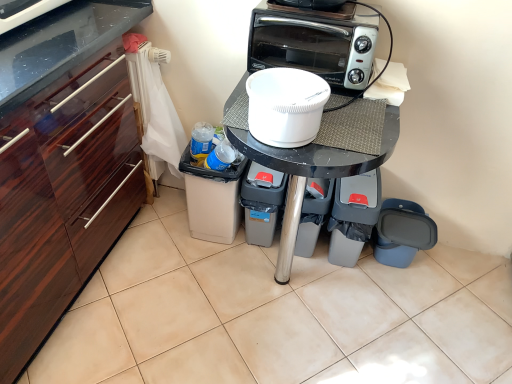
The width and height of the screenshot is (512, 384). Describe the element at coordinates (262, 202) in the screenshot. I see `gray plastic trash bin at lower center, positioned as the first appliance in left-to-right order` at that location.

At what (x,y) coordinates should I click in order to perform the action: click on white plastic container at center. Please return your answer as a coordinate pair (x, y). Looking at the image, I should click on (285, 106).

Measure the distance between gray plastic trash can at lower center, positioned as the 2th appliance in left-to-right order, and camera.

1.49 meters.

I want to click on gray plastic trash can at lower right, placed as the second appliance when sorted from right to left, so click(x=353, y=216).

Could gray plastic trash can at lower center, positioned as the 2th appliance in left-to-right order, be considered to be inside white plastic container at center?

No, gray plastic trash can at lower center, positioned as the 2th appliance in left-to-right order, is not a part of white plastic container at center.

Considering the sizes of objects white plastic container at center and gray plastic trash can at lower center, positioned as the 2th appliance in left-to-right order, in the image provided, who is shorter, white plastic container at center or gray plastic trash can at lower center, positioned as the 2th appliance in left-to-right order,?

white plastic container at center is shorter.

What's the angular difference between white plastic container at center and gray plastic trash can at lower center, positioned as the 2th appliance in left-to-right order,'s facing directions?

There is a 0.289-degree angle between the facing directions of white plastic container at center and gray plastic trash can at lower center, positioned as the 2th appliance in left-to-right order.

Would you consider white plastic container at center to be distant from gray plastic trash can at lower center, which is the 3th appliance in right-to-left order?

No, white plastic container at center is not far away from gray plastic trash can at lower center, which is the 3th appliance in right-to-left order.

Between gray plastic trash can at lower center, positioned as the 2th appliance in left-to-right order, and silver metallic toaster oven at upper center, which one has less height?

Standing shorter between the two is silver metallic toaster oven at upper center.

Where is `kitchen appliance in front of the gray plastic trash can at lower center, positioned as the 2th appliance in left-to-right order`? kitchen appliance in front of the gray plastic trash can at lower center, positioned as the 2th appliance in left-to-right order is located at coordinates (314, 42).

Is silver metallic toaster oven at upper center at the back of gray plastic trash can at lower center, which is the 3th appliance in right-to-left order?

No.

Which is more to the left, gray plastic trash can at lower center, positioned as the 2th appliance in left-to-right order, or silver metallic toaster oven at upper center?

From the viewer's perspective, silver metallic toaster oven at upper center appears more on the left side.

In the scene shown: From the image's perspective, is black glossy table at center over blue plastic trash can at lower right, which appears as the fourth appliance when viewed from the left?

Correct, black glossy table at center appears higher than blue plastic trash can at lower right, which appears as the fourth appliance when viewed from the left, in the image.

Does black glossy table at center appear on the left side of blue plastic trash can at lower right, acting as the 1th appliance starting from the right?

Yes.

Is black glossy table at center turned away from blue plastic trash can at lower right, acting as the 1th appliance starting from the right?

black glossy table at center does not have its back to blue plastic trash can at lower right, acting as the 1th appliance starting from the right.

How many degrees apart are the facing directions of gray plastic trash can at lower right, which ranks as the 3th appliance in left-to-right order, and gray plastic trash can at lower center, which is the 3th appliance in right-to-left order?

The facing directions of gray plastic trash can at lower right, which ranks as the 3th appliance in left-to-right order, and gray plastic trash can at lower center, which is the 3th appliance in right-to-left order, are 1.99e-05 degrees apart.

In terms of height, does gray plastic trash can at lower right, which ranks as the 3th appliance in left-to-right order, look taller or shorter compared to gray plastic trash can at lower center, positioned as the 2th appliance in left-to-right order?

In the image, gray plastic trash can at lower right, which ranks as the 3th appliance in left-to-right order, appears to be taller than gray plastic trash can at lower center, positioned as the 2th appliance in left-to-right order.

Which is in front, gray plastic trash can at lower right, which ranks as the 3th appliance in left-to-right order, or gray plastic trash can at lower center, positioned as the 2th appliance in left-to-right order?

gray plastic trash can at lower right, which ranks as the 3th appliance in left-to-right order, is closer to the camera.

Can you confirm if gray plastic trash can at lower right, which ranks as the 3th appliance in left-to-right order, is positioned to the right of gray plastic trash can at lower center, which is the 3th appliance in right-to-left order?

Correct, you'll find gray plastic trash can at lower right, which ranks as the 3th appliance in left-to-right order, to the right of gray plastic trash can at lower center, which is the 3th appliance in right-to-left order.

Between gray plastic trash can at lower center, positioned as the 2th appliance in left-to-right order, and white plastic container at center, which one has larger width?

With larger width is gray plastic trash can at lower center, positioned as the 2th appliance in left-to-right order.

From the picture: Is white plastic container at center located within gray plastic trash can at lower center, positioned as the 2th appliance in left-to-right order?

No.

From a real-world perspective, which is physically below, gray plastic trash can at lower center, positioned as the 2th appliance in left-to-right order, or white plastic container at center?

From a 3D spatial view, gray plastic trash can at lower center, positioned as the 2th appliance in left-to-right order, is below.

How different are the orientations of gray plastic trash can at lower center, positioned as the 2th appliance in left-to-right order, and white plastic container at center in degrees?

The angle between the facing direction of gray plastic trash can at lower center, positioned as the 2th appliance in left-to-right order, and the facing direction of white plastic container at center is 0.289 degrees.

Which is correct: gray plastic trash can at lower center, positioned as the 2th appliance in left-to-right order, is inside blue plastic trash can at lower right, acting as the 1th appliance starting from the right, or outside of it?

The correct answer is: outside.

Visually, is gray plastic trash can at lower center, positioned as the 2th appliance in left-to-right order, positioned to the left or to the right of blue plastic trash can at lower right, which appears as the fourth appliance when viewed from the left?

gray plastic trash can at lower center, positioned as the 2th appliance in left-to-right order, is to the left of blue plastic trash can at lower right, which appears as the fourth appliance when viewed from the left.

From a real-world perspective, is gray plastic trash can at lower center, which is the 3th appliance in right-to-left order, physically above blue plastic trash can at lower right, acting as the 1th appliance starting from the right?

Yes, from a real-world perspective, gray plastic trash can at lower center, which is the 3th appliance in right-to-left order, is above blue plastic trash can at lower right, acting as the 1th appliance starting from the right.

Would you consider gray plastic trash can at lower center, which is the 3th appliance in right-to-left order, to be distant from blue plastic trash can at lower right, which appears as the fourth appliance when viewed from the left?

gray plastic trash can at lower center, which is the 3th appliance in right-to-left order, is near blue plastic trash can at lower right, which appears as the fourth appliance when viewed from the left, not far away.

How far apart are gray plastic trash can at lower right, which ranks as the 3th appliance in left-to-right order, and black glossy table at center?

They are 19.27 inches apart.

Between gray plastic trash can at lower right, placed as the second appliance when sorted from right to left, and black glossy table at center, which one appears on the right side from the viewer's perspective?

gray plastic trash can at lower right, placed as the second appliance when sorted from right to left.

Does gray plastic trash can at lower right, placed as the second appliance when sorted from right to left, have a smaller size compared to black glossy table at center?

Yes, gray plastic trash can at lower right, placed as the second appliance when sorted from right to left, is smaller than black glossy table at center.

Is point (353, 243) more distant than point (358, 163)?

Yes, it is behind point (358, 163).

Where is `home appliance above the gray plastic trash can at lower center, positioned as the 2th appliance in left-to-right order (from a real-world perspective)`? This screenshot has width=512, height=384. home appliance above the gray plastic trash can at lower center, positioned as the 2th appliance in left-to-right order (from a real-world perspective) is located at coordinates (285, 106).

Locate an element on the screen. The height and width of the screenshot is (384, 512). kitchen appliance on the left of gray plastic trash can at lower center, positioned as the 2th appliance in left-to-right order is located at coordinates (314, 42).

Estimate the real-world distances between objects in this image. Which object is further from white plastic container at center, gray plastic trash bin at lower center, positioned as the first appliance in left-to-right order, or gray plastic trash can at lower right, which ranks as the 3th appliance in left-to-right order?

Based on the image, gray plastic trash can at lower right, which ranks as the 3th appliance in left-to-right order, appears to be further to white plastic container at center.

When comparing their distances from gray plastic trash can at lower center, which is the 3th appliance in right-to-left order, does gray plastic trash can at lower right, which ranks as the 3th appliance in left-to-right order, or white plastic container at center seem further?

The object further to gray plastic trash can at lower center, which is the 3th appliance in right-to-left order, is white plastic container at center.

When comparing their distances from gray plastic trash can at lower right, which ranks as the 3th appliance in left-to-right order, does silver metallic toaster oven at upper center or gray plastic trash can at lower center, positioned as the 2th appliance in left-to-right order, seem closer?

gray plastic trash can at lower center, positioned as the 2th appliance in left-to-right order, lies closer to gray plastic trash can at lower right, which ranks as the 3th appliance in left-to-right order, than the other object.

Considering their positions, is gray plastic trash can at lower center, positioned as the 2th appliance in left-to-right order, positioned closer to gray plastic trash can at lower right, which ranks as the 3th appliance in left-to-right order, than silver metallic toaster oven at upper center?

gray plastic trash can at lower center, positioned as the 2th appliance in left-to-right order.

From the image, which object appears to be farther from gray plastic trash can at lower center, which is the 3th appliance in right-to-left order, gray plastic trash bin at lower center, which is counted as the 4th appliance, starting from the right, or black glossy table at center?

Based on the image, black glossy table at center appears to be further to gray plastic trash can at lower center, which is the 3th appliance in right-to-left order.

Which object lies nearer to the anchor point gray plastic trash bin at lower center, which is counted as the 4th appliance, starting from the right, gray plastic trash can at lower center, positioned as the 2th appliance in left-to-right order, or white plastic container at center?

gray plastic trash can at lower center, positioned as the 2th appliance in left-to-right order, is closer to gray plastic trash bin at lower center, which is counted as the 4th appliance, starting from the right.

Estimate the real-world distances between objects in this image. Which object is further from blue plastic trash can at lower right, acting as the 1th appliance starting from the right, black glossy table at center or gray plastic trash bin at lower center, positioned as the first appliance in left-to-right order?

Based on the image, black glossy table at center appears to be further to blue plastic trash can at lower right, acting as the 1th appliance starting from the right.

Considering their positions, is blue plastic trash can at lower right, which appears as the fourth appliance when viewed from the left, positioned closer to gray plastic trash bin at lower center, positioned as the first appliance in left-to-right order, than gray plastic trash can at lower center, which is the 3th appliance in right-to-left order?

gray plastic trash can at lower center, which is the 3th appliance in right-to-left order.

Where is `appliance between gray plastic trash can at lower center, positioned as the 2th appliance in left-to-right order, and blue plastic trash can at lower right, acting as the 1th appliance starting from the right, from left to right`? The image size is (512, 384). appliance between gray plastic trash can at lower center, positioned as the 2th appliance in left-to-right order, and blue plastic trash can at lower right, acting as the 1th appliance starting from the right, from left to right is located at coordinates (353, 216).

What are the coordinates of `table between white plastic container at center and gray plastic trash can at lower right, placed as the second appliance when sorted from right to left, in the front-back direction` in the screenshot? It's located at (315, 154).

The image size is (512, 384). Find the location of `table between white plastic container at center and gray plastic trash can at lower center, which is the 3th appliance in right-to-left order, along the z-axis`. table between white plastic container at center and gray plastic trash can at lower center, which is the 3th appliance in right-to-left order, along the z-axis is located at coordinates (315, 154).

At what (x,y) coordinates should I click in order to perform the action: click on home appliance between silver metallic toaster oven at upper center and blue plastic trash can at lower right, which appears as the fourth appliance when viewed from the left, in the vertical direction. Please return your answer as a coordinate pair (x, y). The width and height of the screenshot is (512, 384). Looking at the image, I should click on (285, 106).